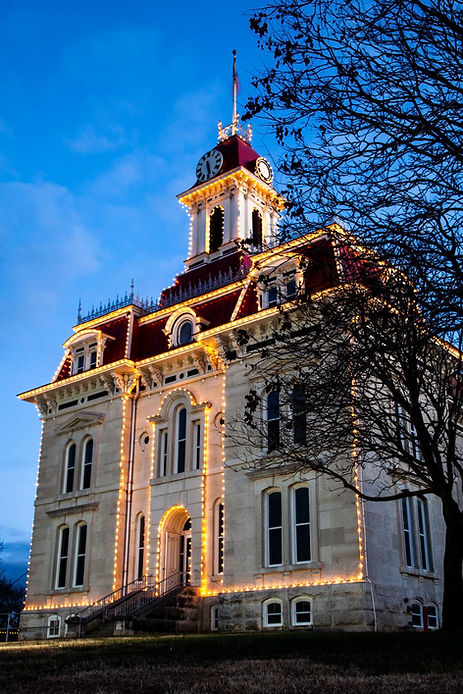
Find the location of `clock`. clock is located at coordinates (209, 160), (263, 164).